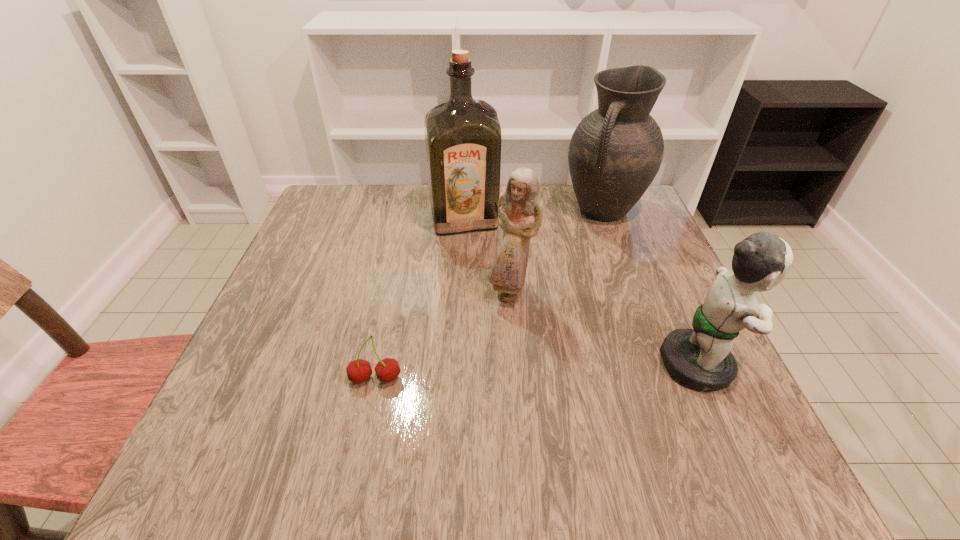
The width and height of the screenshot is (960, 540). What are the coordinates of `vacant spot on the desktop that is between the cherry and the nearer figurine and is positioned on the label of the liquor` in the screenshot? It's located at (506, 373).

The image size is (960, 540). In order to click on free spot on the desktop that is between the cherry and the nearer figurine and is positioned on the front-facing side of the third farthest object in this screenshot , I will do `click(531, 372)`.

Where is `free space on the desktop that is between the shortest object and the right figurine and is positioned on the side of the pitcher with the handle`? The image size is (960, 540). free space on the desktop that is between the shortest object and the right figurine and is positioned on the side of the pitcher with the handle is located at coordinates coord(495,373).